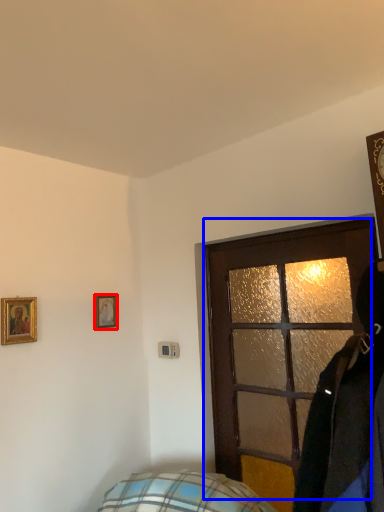
Question: Which of the following is the closest to the observer, picture frame (highlighted by a red box) or door (highlighted by a blue box)?

Choices:
 (A) picture frame
 (B) door

Answer: (B)